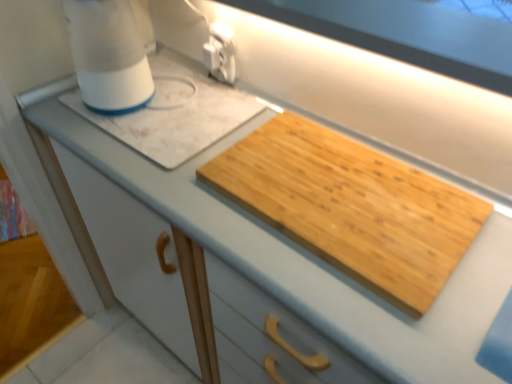
Question: From a real-world perspective, is natural wood cutting board at center positioned under white plastic blender at upper left based on gravity?

Choices:
 (A) no
 (B) yes

Answer: (B)

Question: Is the position of natural wood cutting board at center more distant than that of white plastic blender at upper left?

Choices:
 (A) no
 (B) yes

Answer: (A)

Question: From a real-world perspective, does natural wood cutting board at center stand above white plastic blender at upper left?

Choices:
 (A) yes
 (B) no

Answer: (B)

Question: Can you confirm if natural wood cutting board at center is smaller than white plastic blender at upper left?

Choices:
 (A) no
 (B) yes

Answer: (B)

Question: From the image's perspective, would you say natural wood cutting board at center is positioned over white plastic blender at upper left?

Choices:
 (A) yes
 (B) no

Answer: (B)

Question: From a real-world perspective, is white plastic blender at upper left above or below white plastic electric outlet at upper center?

Choices:
 (A) above
 (B) below

Answer: (A)

Question: From the image's perspective, is white plastic blender at upper left above or below white plastic electric outlet at upper center?

Choices:
 (A) above
 (B) below

Answer: (A)

Question: Visually, is white plastic blender at upper left positioned to the left or to the right of white plastic electric outlet at upper center?

Choices:
 (A) left
 (B) right

Answer: (A)

Question: Does point (105, 72) appear closer or farther from the camera than point (205, 56)?

Choices:
 (A) farther
 (B) closer

Answer: (B)

Question: In the image, is white plastic electric outlet at upper center positioned in front of or behind natural wood cutting board at center?

Choices:
 (A) front
 (B) behind

Answer: (B)

Question: From a real-world perspective, is white plastic electric outlet at upper center above or below natural wood cutting board at center?

Choices:
 (A) below
 (B) above

Answer: (B)

Question: Is white plastic electric outlet at upper center inside the boundaries of natural wood cutting board at center, or outside?

Choices:
 (A) outside
 (B) inside

Answer: (A)

Question: Is white plastic electric outlet at upper center bigger or smaller than natural wood cutting board at center?

Choices:
 (A) small
 (B) big

Answer: (A)

Question: Considering the positions of natural wood cutting board at center and white plastic blender at upper left in the image, is natural wood cutting board at center wider or thinner than white plastic blender at upper left?

Choices:
 (A) wide
 (B) thin

Answer: (A)

Question: In terms of height, does natural wood cutting board at center look taller or shorter compared to white plastic blender at upper left?

Choices:
 (A) short
 (B) tall

Answer: (A)